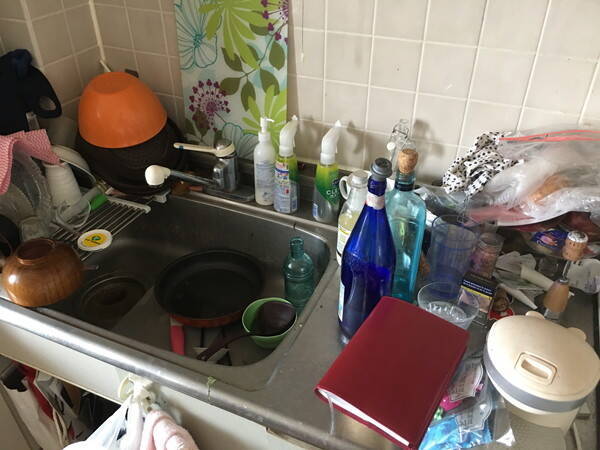
Locate an element on the screen. The width and height of the screenshot is (600, 450). wooden bowl is located at coordinates (x=68, y=282).